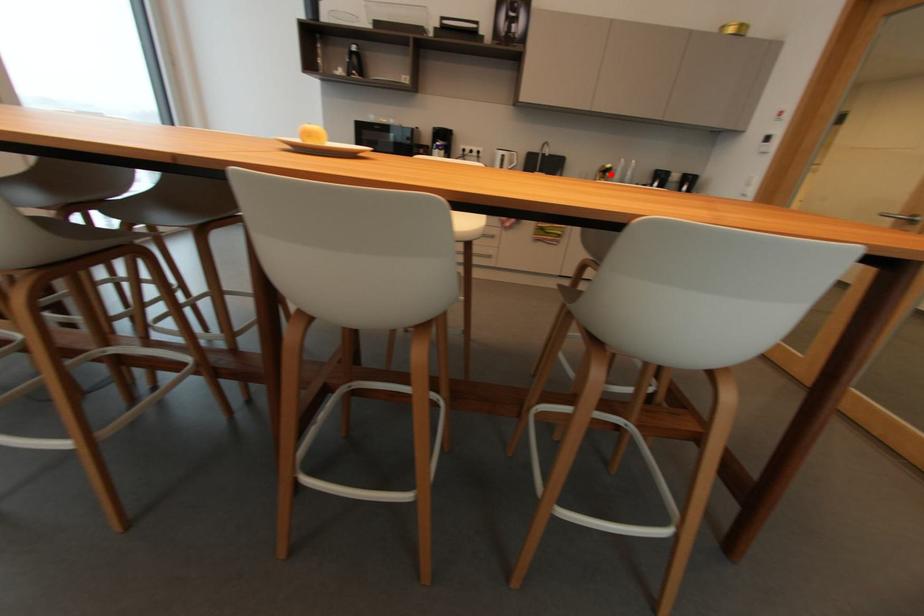
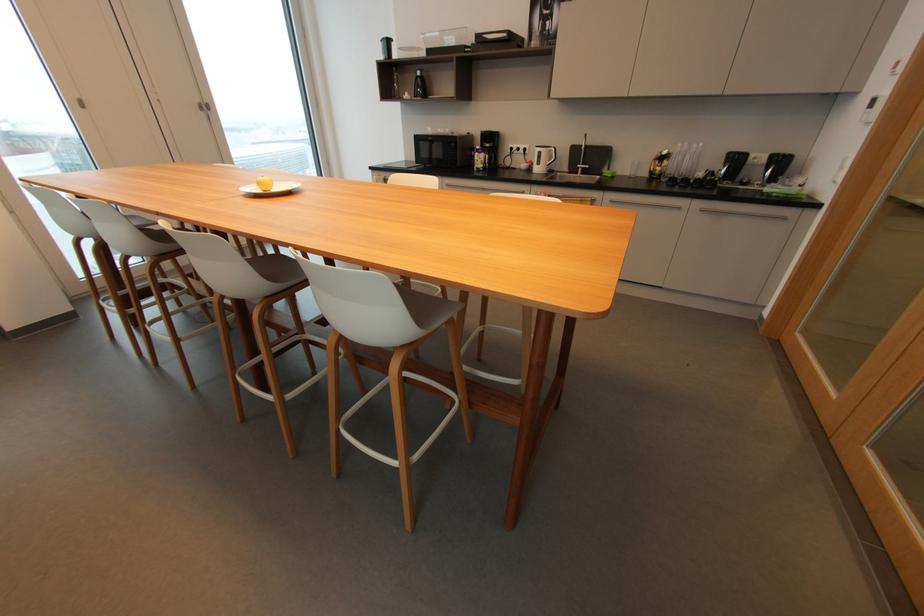
In the second image, find the point that corresponds to the highlighted location in the first image.

(669, 161)